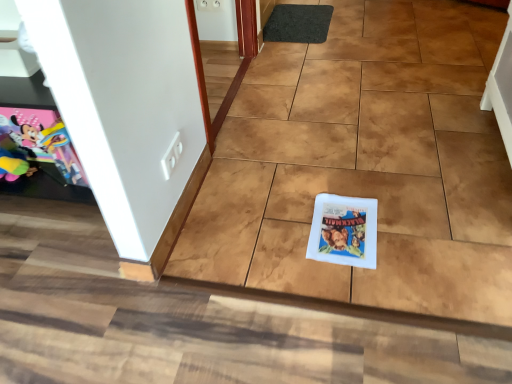
Find the location of a particular element. The height and width of the screenshot is (384, 512). vacant space to the right of white paper comic book at center, which is the second comic book from top to bottom is located at coordinates (411, 225).